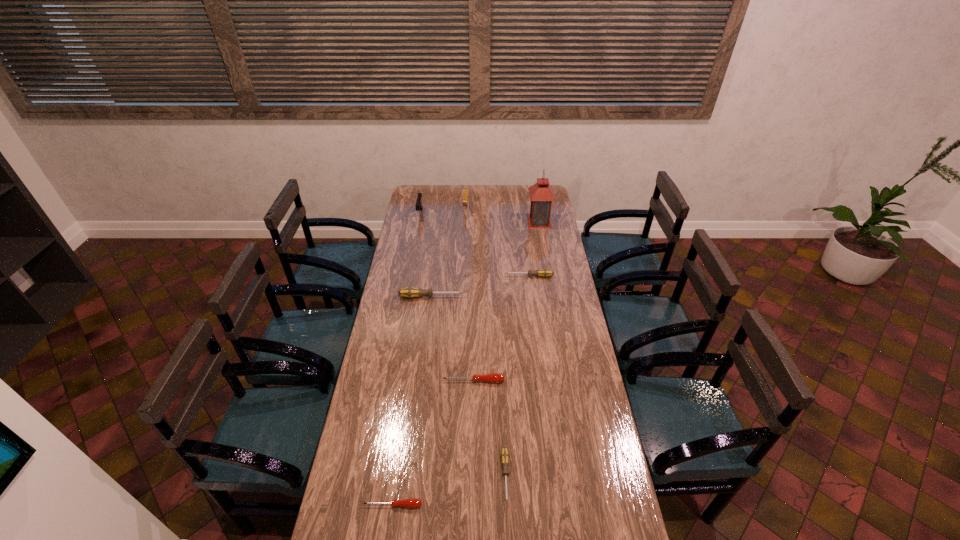
Identify the location of the tallest object. (541, 194).

You are a GUI agent. You are given a task and a screenshot of the screen. Output one action in this format:
    pyautogui.click(x=<x>, y=<y>)
    Task: Click on the pink lantern
    The height and width of the screenshot is (540, 960).
    Given the screenshot: What is the action you would take?
    point(541,194)

The width and height of the screenshot is (960, 540). I want to click on the left pistol, so click(419, 206).

At what (x,y) coordinates should I click in order to perform the action: click on tan pistol. Please return your answer as a coordinate pair (x, y). Looking at the image, I should click on [465, 190].

Find the location of a particular element. The image size is (960, 540). the biggest gray screwdriver is located at coordinates (410, 292).

At what (x,y) coordinates should I click in order to perform the action: click on the leftmost gray screwdriver. Please return your answer as a coordinate pair (x, y). Looking at the image, I should click on (410, 292).

Where is `the farthest screwdriver`? the farthest screwdriver is located at coordinates (544, 272).

Locate an element on the screen. This screenshot has width=960, height=540. the fourth farthest object is located at coordinates (544, 272).

At what (x,y) coordinates should I click in order to perform the action: click on the sixth farthest object. Please return your answer as a coordinate pair (x, y). The width and height of the screenshot is (960, 540). Looking at the image, I should click on (493, 377).

The width and height of the screenshot is (960, 540). I want to click on the bigger red screwdriver, so click(493, 377).